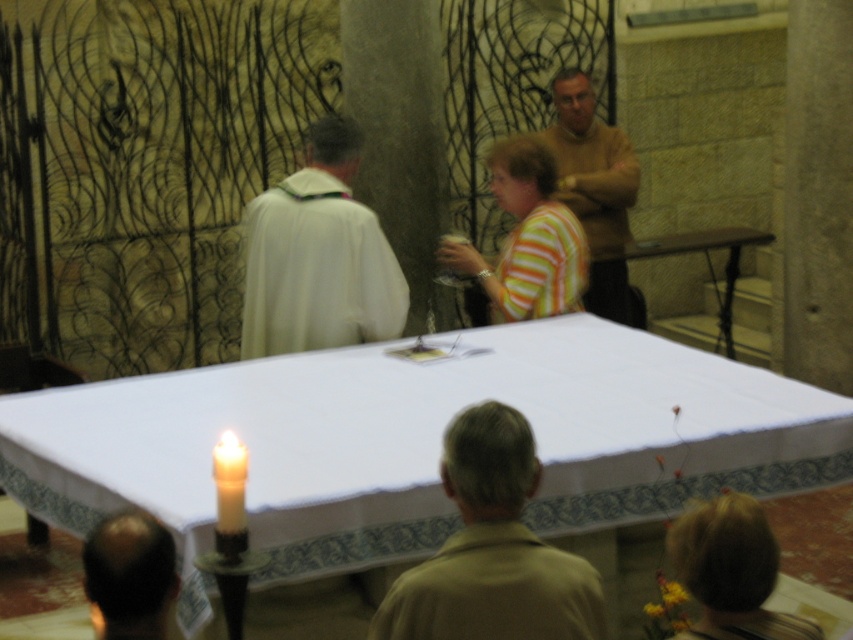
Can you confirm if white cloth table at center is positioned to the right of white clothed figure at center?

Correct, you'll find white cloth table at center to the right of white clothed figure at center.

Does white cloth table at center have a lesser width compared to white clothed figure at center?

No.

Locate an element on the screen. white cloth table at center is located at coordinates (415, 442).

Does beige sweater at upper right appear under bald head at lower left?

No, beige sweater at upper right is not below bald head at lower left.

What do you see at coordinates (595, 188) in the screenshot?
I see `beige sweater at upper right` at bounding box center [595, 188].

At what (x,y) coordinates should I click in order to perform the action: click on beige sweater at upper right. Please return your answer as a coordinate pair (x, y). The height and width of the screenshot is (640, 853). Looking at the image, I should click on (595, 188).

The width and height of the screenshot is (853, 640). Identify the location of beige sweater at upper right. (595, 188).

Based on the photo, is white cloth table at center above striped fabric shirt at center?

No.

Does point (126, 499) lie in front of point (509, 172)?

Yes, point (126, 499) is in front of point (509, 172).

Who is more forward, (x=306, y=480) or (x=537, y=211)?

Point (x=306, y=480)

Find the location of `white cloth table at center`. white cloth table at center is located at coordinates (415, 442).